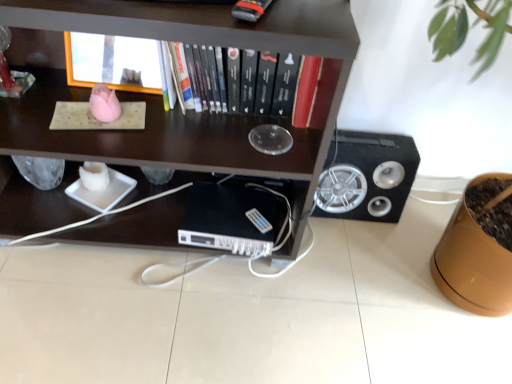
Describe the element at coordinates (229, 219) in the screenshot. I see `black plastic computer at center` at that location.

Measure the distance between hardcover book at center and camera.

hardcover book at center is 38.07 inches from camera.

What do you see at coordinates (190, 111) in the screenshot?
I see `dark wood shelf at upper center, arranged as the 2th shelf when viewed from the top` at bounding box center [190, 111].

At what (x,y) coordinates should I click in order to perform the action: click on black plastic computer at center. Please return your answer as a coordinate pair (x, y). This screenshot has height=384, width=512. Looking at the image, I should click on (229, 219).

From the image's perspective, is hardcover book at center positioned above or below black matte speaker at right?

hardcover book at center is above black matte speaker at right.

From a real-world perspective, which object rests below the other?

black matte speaker at right, from a real-world perspective.

Considering the positions of points (317, 75) and (331, 181), is point (317, 75) farther from camera compared to point (331, 181)?

No, (317, 75) is in front of (331, 181).

Where is `speaker on the right of hardcover book at center`? speaker on the right of hardcover book at center is located at coordinates (367, 176).

Where is `computer on the right of wooden frame at upper center, which appears as the second shelf when ordered from the bottom`? The image size is (512, 384). computer on the right of wooden frame at upper center, which appears as the second shelf when ordered from the bottom is located at coordinates (229, 219).

Is wooden frame at upper center, the first shelf viewed from the top, far from black plastic computer at center?

No, wooden frame at upper center, the first shelf viewed from the top, is in close proximity to black plastic computer at center.

Could you tell me if wooden frame at upper center, which appears as the second shelf when ordered from the bottom, is turned towards black plastic computer at center?

No, wooden frame at upper center, which appears as the second shelf when ordered from the bottom, is not turned towards black plastic computer at center.

From the image's perspective, is wooden frame at upper center, which appears as the second shelf when ordered from the bottom, above or below black plastic computer at center?

wooden frame at upper center, which appears as the second shelf when ordered from the bottom, is above black plastic computer at center.

Is point (60, 140) closer or farther from the camera than point (140, 60)?

Point (60, 140) appears to be closer to the viewer than point (140, 60).

From a real-world perspective, which is physically above, dark wood shelf at upper center, arranged as the 2th shelf when viewed from the top, or wooden frame at upper center, which appears as the second shelf when ordered from the bottom?

wooden frame at upper center, which appears as the second shelf when ordered from the bottom, is physically above.

Locate an element on the screen. This screenshot has height=384, width=512. shelf lying in front of the wooden frame at upper center, which appears as the second shelf when ordered from the bottom is located at coordinates (190, 111).

Which of these two, dark wood shelf at upper center, arranged as the 1th shelf when ordered from the bottom, or wooden frame at upper center, the first shelf viewed from the top, is thinner?

wooden frame at upper center, the first shelf viewed from the top.

Based on their positions, is dark wood shelf at upper center, arranged as the 1th shelf when ordered from the bottom, located to the left or right of black matte speaker at right?

dark wood shelf at upper center, arranged as the 1th shelf when ordered from the bottom, is to the left of black matte speaker at right.

Are dark wood shelf at upper center, arranged as the 2th shelf when viewed from the top, and black matte speaker at right far apart?

They are positioned close to each other.

What are the coordinates of `speaker on the right of the dark wood shelf at upper center, arranged as the 2th shelf when viewed from the top` in the screenshot? It's located at (367, 176).

Is black matte speaker at right at the back of dark wood shelf at upper center, arranged as the 2th shelf when viewed from the top?

dark wood shelf at upper center, arranged as the 2th shelf when viewed from the top, does not have its back to black matte speaker at right.

Considering the sizes of objects hardcover book at center and black plastic computer at center in the image provided, who is bigger, hardcover book at center or black plastic computer at center?

Bigger between the two is hardcover book at center.

Would you say hardcover book at center is outside black plastic computer at center?

Yes, hardcover book at center is located beyond the bounds of black plastic computer at center.

From the image's perspective, is hardcover book at center on top of black plastic computer at center?

Correct, hardcover book at center appears higher than black plastic computer at center in the image.

Between hardcover book at center and black plastic computer at center, which one is positioned in front?

hardcover book at center is closer to the camera.

Is point (258, 105) behind point (153, 90)?

No, (258, 105) is in front of (153, 90).

Looking at this image, from the image's perspective, which object appears higher, hardcover book at center or wooden frame at upper center, which appears as the second shelf when ordered from the bottom?

From the image's view, wooden frame at upper center, which appears as the second shelf when ordered from the bottom, is above.

Is hardcover book at center taller or shorter than wooden frame at upper center, the first shelf viewed from the top?

Considering their sizes, hardcover book at center has less height than wooden frame at upper center, the first shelf viewed from the top.

Where is `speaker below the wooden frame at upper center, the first shelf viewed from the top (from a real-world perspective)`? The image size is (512, 384). speaker below the wooden frame at upper center, the first shelf viewed from the top (from a real-world perspective) is located at coordinates (367, 176).

Does wooden frame at upper center, which appears as the second shelf when ordered from the bottom, appear on the right side of black matte speaker at right?

No.

Between wooden frame at upper center, which appears as the second shelf when ordered from the bottom, and black matte speaker at right, which one has less height?

Standing shorter between the two is wooden frame at upper center, which appears as the second shelf when ordered from the bottom.

From a real-world perspective, is wooden frame at upper center, which appears as the second shelf when ordered from the bottom, beneath black matte speaker at right?

No, from a real-world perspective, wooden frame at upper center, which appears as the second shelf when ordered from the bottom, is not under black matte speaker at right.

Image resolution: width=512 pixels, height=384 pixels. In order to click on book above the black matte speaker at right (from a real-world perspective) in this screenshot , I will do `click(247, 84)`.

Find the location of a particular element. Image resolution: width=512 pixels, height=384 pixels. computer below the wooden frame at upper center, the first shelf viewed from the top (from a real-world perspective) is located at coordinates (229, 219).

Considering their positions, is dark wood shelf at upper center, arranged as the 1th shelf when ordered from the bottom, positioned closer to black matte speaker at right than hardcover book at center?

Based on the image, hardcover book at center appears to be nearer to black matte speaker at right.

Looking at the image, which one is located further to hardcover book at center, dark wood shelf at upper center, arranged as the 1th shelf when ordered from the bottom, or black matte speaker at right?

The object further to hardcover book at center is black matte speaker at right.

Based on the photo, looking at the image, which one is located closer to wooden frame at upper center, which appears as the second shelf when ordered from the bottom, dark wood shelf at upper center, arranged as the 2th shelf when viewed from the top, or black matte speaker at right?

Based on the image, dark wood shelf at upper center, arranged as the 2th shelf when viewed from the top, appears to be nearer to wooden frame at upper center, which appears as the second shelf when ordered from the bottom.

Estimate the real-world distances between objects in this image. Which object is closer to black matte speaker at right, hardcover book at center or dark wood shelf at upper center, arranged as the 1th shelf when ordered from the bottom?

hardcover book at center lies closer to black matte speaker at right than the other object.

Considering their positions, is wooden frame at upper center, the first shelf viewed from the top, positioned further to black plastic computer at center than black matte speaker at right?

wooden frame at upper center, the first shelf viewed from the top, is positioned further to the anchor black plastic computer at center.

Considering their positions, is wooden frame at upper center, which appears as the second shelf when ordered from the bottom, positioned further to hardcover book at center than black matte speaker at right?

Based on the image, black matte speaker at right appears to be further to hardcover book at center.

Considering their positions, is wooden frame at upper center, the first shelf viewed from the top, positioned closer to black plastic computer at center than dark wood shelf at upper center, arranged as the 1th shelf when ordered from the bottom?

dark wood shelf at upper center, arranged as the 1th shelf when ordered from the bottom, is positioned closer to the anchor black plastic computer at center.

Based on their spatial positions, is black plastic computer at center or dark wood shelf at upper center, arranged as the 2th shelf when viewed from the top, closer to hardcover book at center?

The object closer to hardcover book at center is dark wood shelf at upper center, arranged as the 2th shelf when viewed from the top.

The width and height of the screenshot is (512, 384). In order to click on computer located between wooden frame at upper center, which appears as the second shelf when ordered from the bottom, and black matte speaker at right in the left-right direction in this screenshot , I will do `click(229, 219)`.

At what (x,y) coordinates should I click in order to perform the action: click on book located between wooden frame at upper center, the first shelf viewed from the top, and black matte speaker at right in the left-right direction. Please return your answer as a coordinate pair (x, y). The height and width of the screenshot is (384, 512). Looking at the image, I should click on tap(247, 84).

Identify the location of book located between dark wood shelf at upper center, arranged as the 1th shelf when ordered from the bottom, and black plastic computer at center in the depth direction. (247, 84).

The width and height of the screenshot is (512, 384). I want to click on book between black plastic computer at center and black matte speaker at right in the horizontal direction, so click(x=247, y=84).